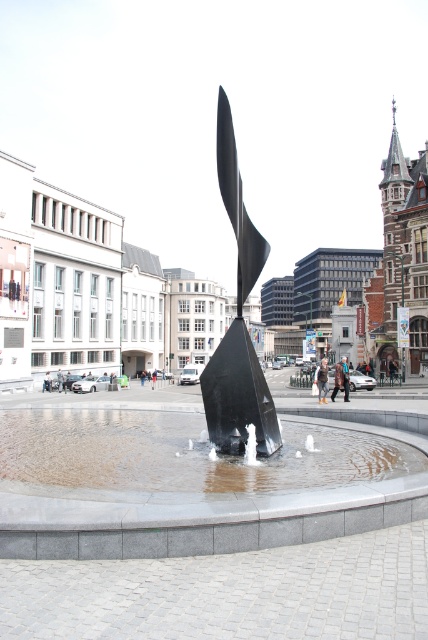
You are a maintenance worker needing to reach the clear water at fountain center and the polished black sculpture at center. You have a 6.5 meter long hose. Can you water both areas without moving the hose? Please explain.

The distance between the clear water at fountain center and the polished black sculpture at center is 6.68 meters. Since the hose is only 6.5 meters long, it is too short to reach both areas without moving it. You will need to move the hose to cover both locations.

You are a city planner evaluating the plaza design. The black polished water at center and the polished black sculpture at center are both central features. Which one has a larger footprint in the plaza layout?

The black polished water at center is bigger than the polished black sculpture at center, so it has a larger footprint in the plaza layout.

You are standing at the center of the plaza facing the sculpture. You want to walk to the point marked by the coordinates point (425,470) and point (134,438). Which point will you reach first?

You will reach point (425,470) first because it is in front of point (134,438) from your current position at the center of the plaza facing the sculpture.